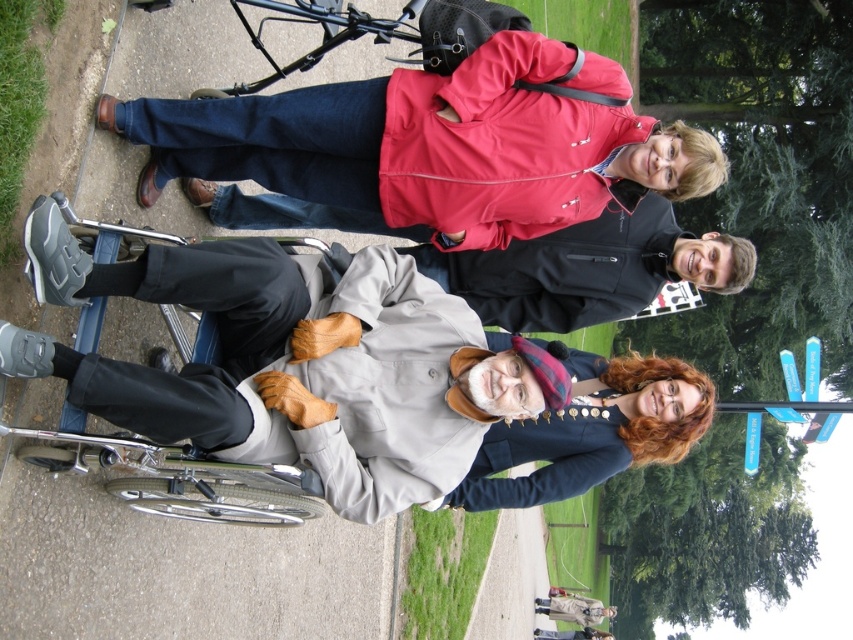
You are a photographer standing at the edge of the gray concrete pavement at lower left. You want to take a photo of the matte red jacket at upper center. Which direction should you move to get a better shot?

The gray concrete pavement at lower left is to the left of the matte red jacket at upper center, so you should move to the right to position yourself closer to the matte red jacket at upper center for a better shot.

You are a photographer standing at the lower left corner of the scene. You want to take a photo of the matte red jacket at upper center without the gray concrete pavement at lower left blocking the view. Is the pavement too tall to block the jacket in the shot?

The gray concrete pavement at lower left is much taller than the matte red jacket at upper center, so it will block the view of the jacket.

You are a photographer planning to take a group photo of the matte red jacket at upper center and the smooth navy blue coat at lower right. Which of the two should you place closer to the camera to make them appear the same size in the photo?

To make the matte red jacket at upper center and the smooth navy blue coat at lower right appear the same size in the photo, you should place the matte red jacket at upper center closer to the camera since it is smaller than the smooth navy blue coat at lower right.